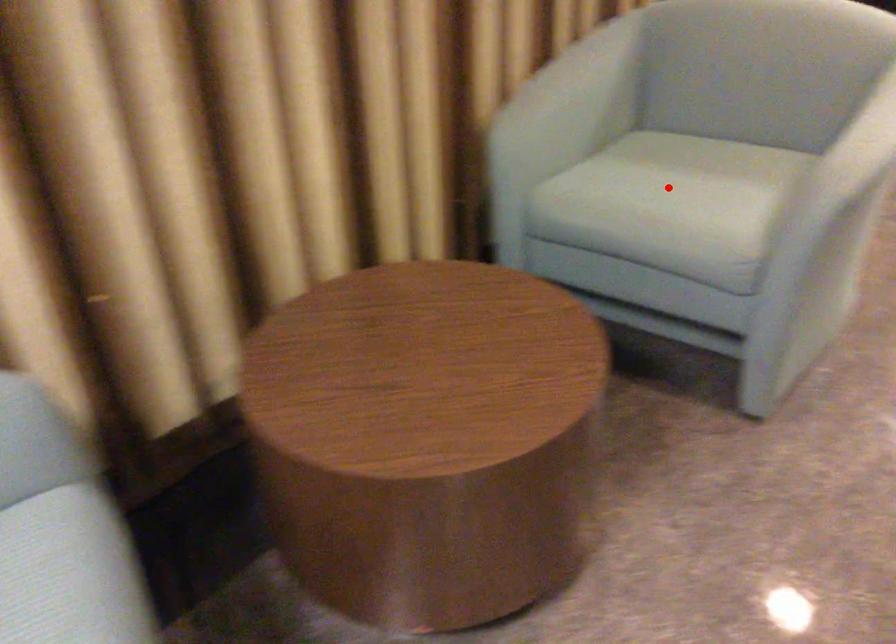
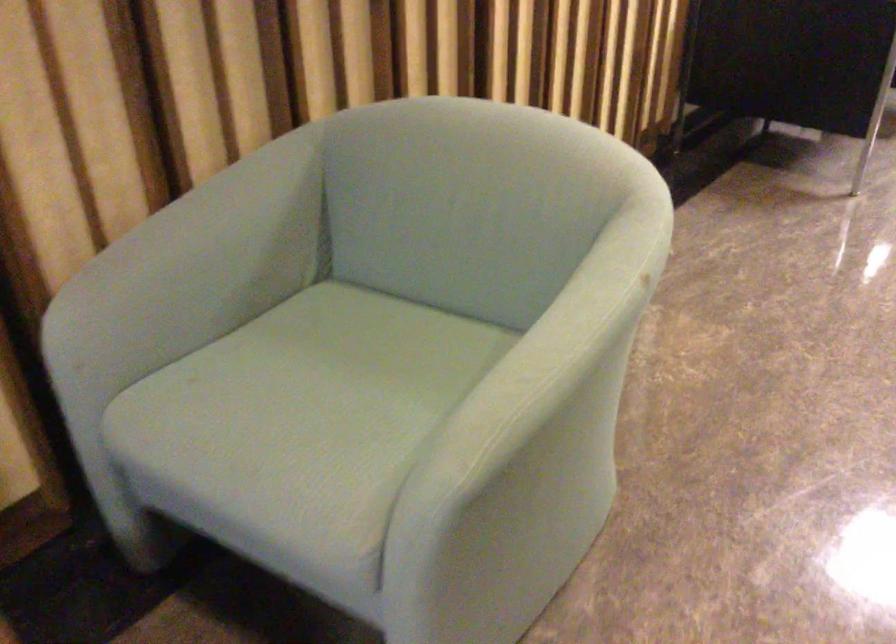
In the second image, find the point that corresponds to the highlighted location in the first image.

(305, 398)